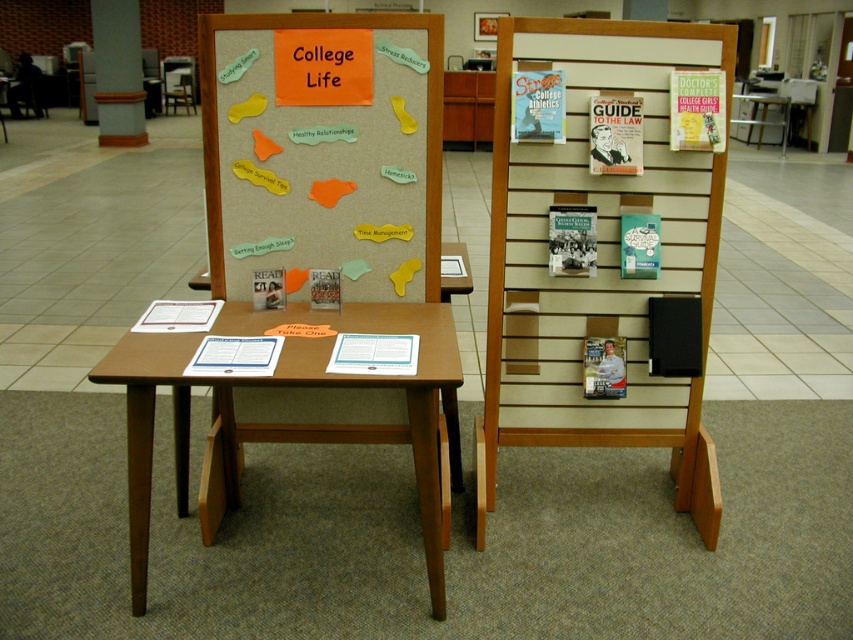
What is located at the coordinates point (323, 148) in the library display setup focused on College Life?

The corkboard at center is located at point (323, 148) in the library display setup focused on College Life.

You are a student standing in front of the library display about College Life. You need to place a new sticky note about time management on the corkboard. The display has a smooth concrete pillar at upper left and a matte plastic chair at center. Which object is closer to the corkboard section where you will place the sticky note?

The smooth concrete pillar at upper left is closer to the corkboard section because it is positioned below the matte plastic chair at center, meaning it is nearer to the corkboard area where the sticky note should be placed.

You are a student trying to sit down and study in the library. You see a smooth concrete pillar at upper left and a matte plastic chair at center. Which object is wider?

The smooth concrete pillar at upper left is wider than the matte plastic chair at center.